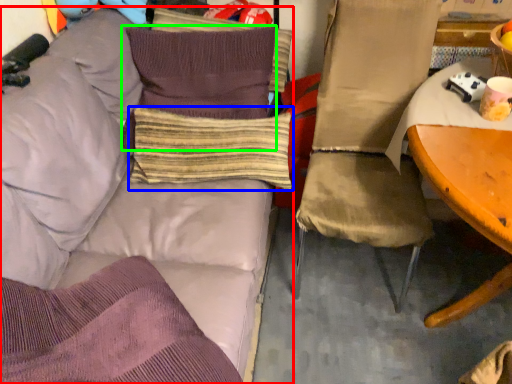
Question: Which object is positioned closest to studio couch (highlighted by a red box)? Select from pillow (highlighted by a blue box) and pillow (highlighted by a green box).

Choices:
 (A) pillow
 (B) pillow

Answer: (B)